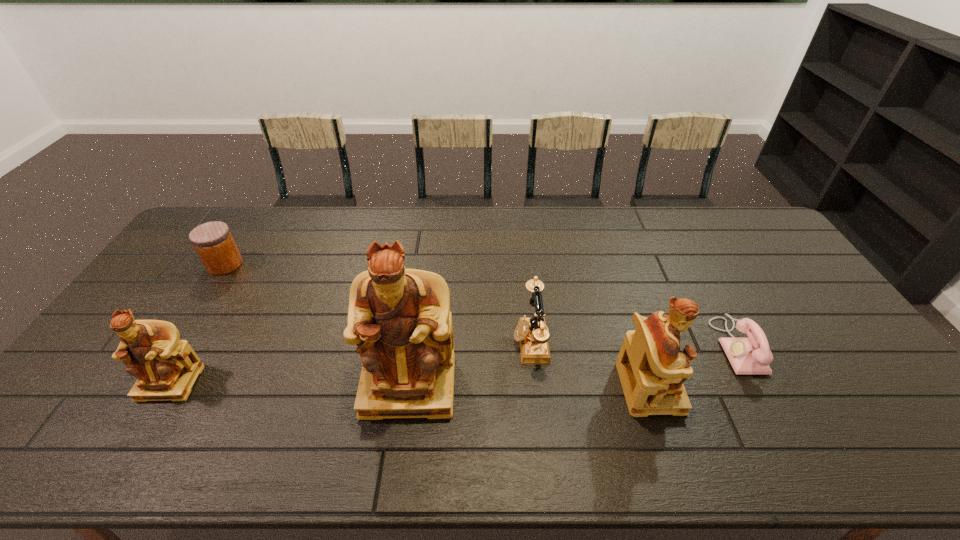
You are a GUI agent. You are given a task and a screenshot of the screen. Output one action in this format:
    pyautogui.click(x=<x>, y=<y>)
    Task: Click on the third tallest object
    The height and width of the screenshot is (540, 960).
    Given the screenshot: What is the action you would take?
    pyautogui.click(x=166, y=368)

Where is `the leftmost figurine`? the leftmost figurine is located at coordinates (166, 368).

Where is `the tallest figurine`? The image size is (960, 540). the tallest figurine is located at coordinates (400, 319).

Locate an element on the screen. This screenshot has height=540, width=960. the tallest object is located at coordinates (400, 319).

The width and height of the screenshot is (960, 540). I want to click on the rightmost figurine, so click(652, 370).

The width and height of the screenshot is (960, 540). I want to click on the second tallest object, so click(652, 370).

The image size is (960, 540). I want to click on the right telephone, so click(752, 355).

The width and height of the screenshot is (960, 540). In order to click on the shortest object in this screenshot , I will do `click(752, 355)`.

Identify the location of the farthest object. The height and width of the screenshot is (540, 960). (213, 241).

This screenshot has height=540, width=960. I want to click on the fifth tallest object, so click(x=213, y=241).